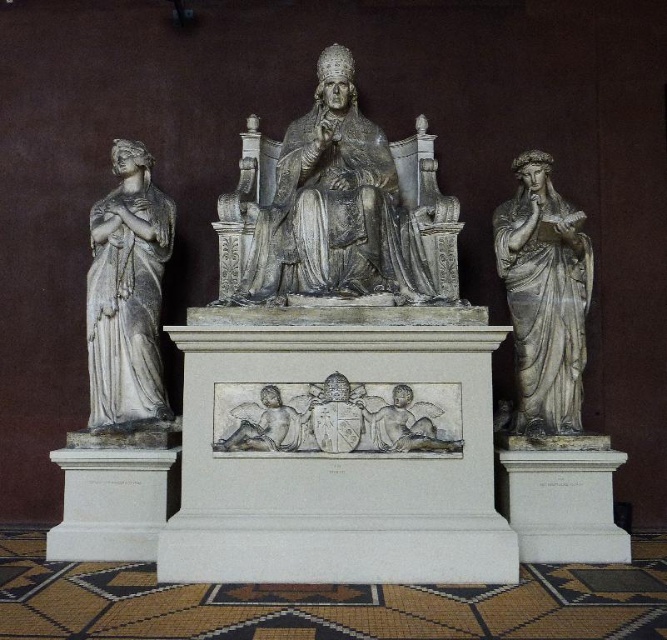
Who is taller, white marble statue at right or white marble cherub at center?

With more height is white marble statue at right.

Looking at this image, is white marble statue at right further to camera compared to white marble cherub at center?

Yes.

The width and height of the screenshot is (667, 640). Describe the element at coordinates (544, 296) in the screenshot. I see `white marble statue at right` at that location.

Find the location of a particular element. white marble statue at right is located at coordinates (544, 296).

Is white marble statue at left taller than white marble cherub at center?

Yes, white marble statue at left is taller than white marble cherub at center.

Is point (111, 337) in front of point (273, 413)?

No, (111, 337) is behind (273, 413).

Where is `white marble statue at left`? Image resolution: width=667 pixels, height=640 pixels. white marble statue at left is located at coordinates (127, 294).

Does matte silver statue at center appear over white marble cherub at center?

Correct, matte silver statue at center is located above white marble cherub at center.

Does matte silver statue at center appear on the left side of white marble cherub at center?

In fact, matte silver statue at center is to the right of white marble cherub at center.

Which is in front, point (348, 138) or point (221, 449)?

Point (221, 449)

Locate an element on the screen. matte silver statue at center is located at coordinates (336, 205).